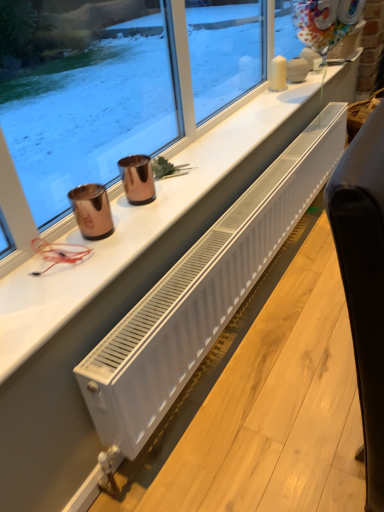
Where is `vacant space situated above white plastic radiator at center (from a real-world perspective)`? vacant space situated above white plastic radiator at center (from a real-world perspective) is located at coordinates (263, 362).